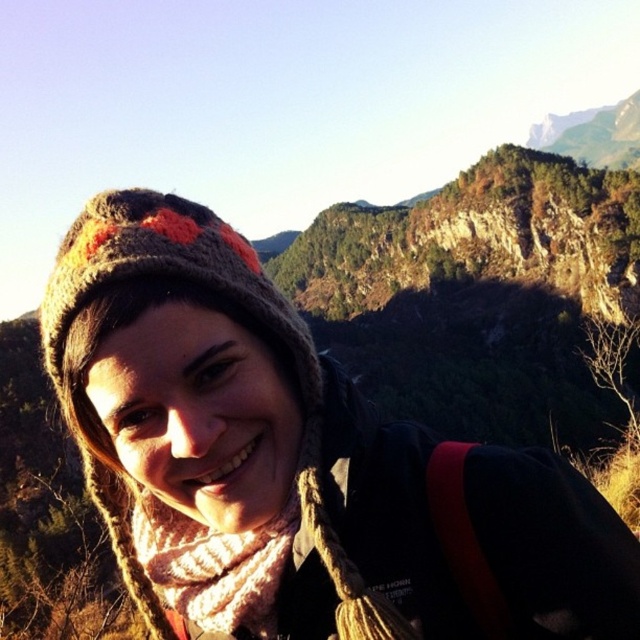
Question: Does knitted woolen hat at upper left have a smaller size compared to knitted beige scarf at lower center?

Choices:
 (A) no
 (B) yes

Answer: (A)

Question: Which point is closer to the camera taking this photo?

Choices:
 (A) (141, 232)
 (B) (204, 593)

Answer: (A)

Question: Which object is farther from the camera taking this photo?

Choices:
 (A) knitted beige scarf at lower center
 (B) knitted woolen hat at upper left

Answer: (A)

Question: Does knitted woolen hat at upper left have a smaller size compared to knitted beige scarf at lower center?

Choices:
 (A) no
 (B) yes

Answer: (A)

Question: Is knitted woolen hat at upper left below knitted beige scarf at lower center?

Choices:
 (A) no
 (B) yes

Answer: (A)